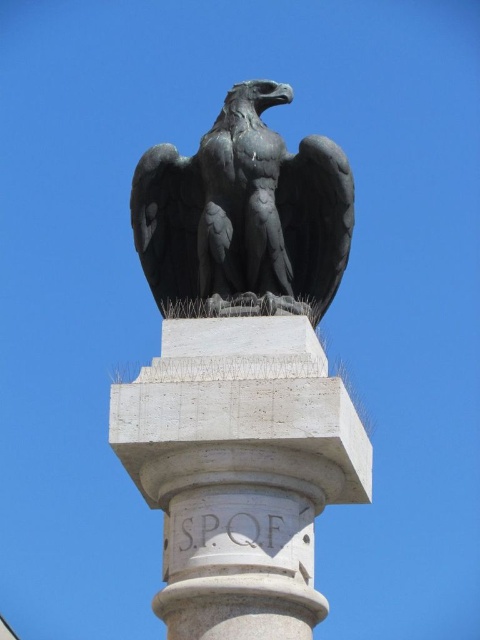
You are standing in front of the statue of the eagle and notice two points on the pedestal. The first point is at coordinates point (201, 340) and the second is at point (176, 182). Which point is closer to your viewpoint?

Point (201, 340) is closer to the camera than point (176, 182).

You are an art conservator examining the statue of the polished bronze eagle at top center and the white stone pillar at center. Based on their positions, which object is closer to the viewer?

The polished bronze eagle at top center is closer to the viewer because the white stone pillar at center is positioned on its right side, meaning it is behind the eagle.